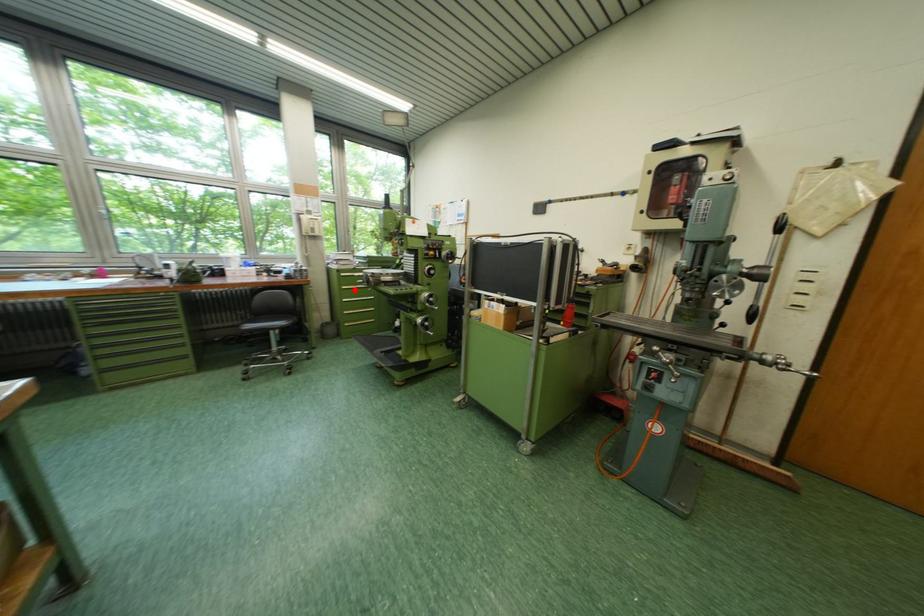
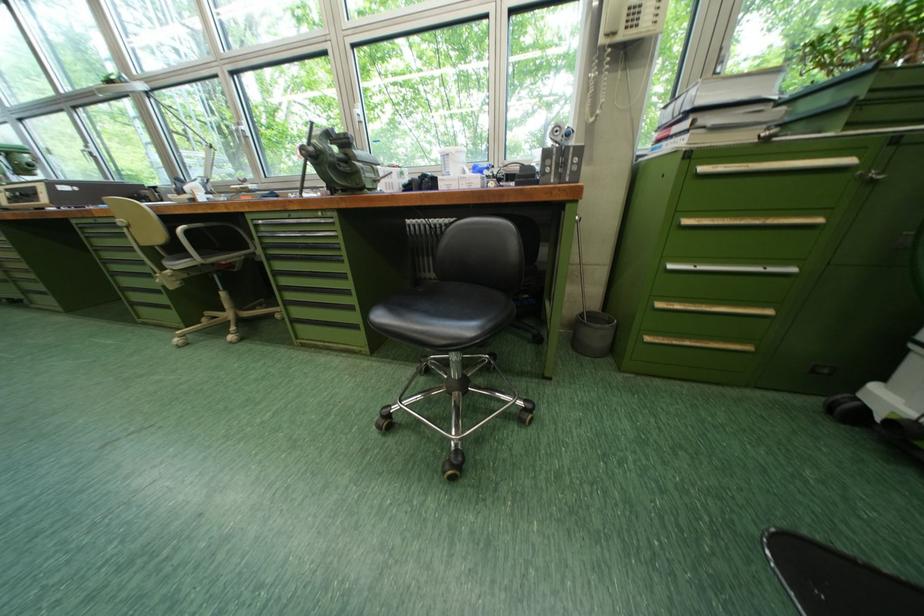
Question: I am providing you with two images of the same scene from different viewpoints. In image1, a red point is highlighted. Considering the same 3D point in image2, which of the following is correct?

Choices:
 (A) It is closer
 (B) It is farther

Answer: (A)